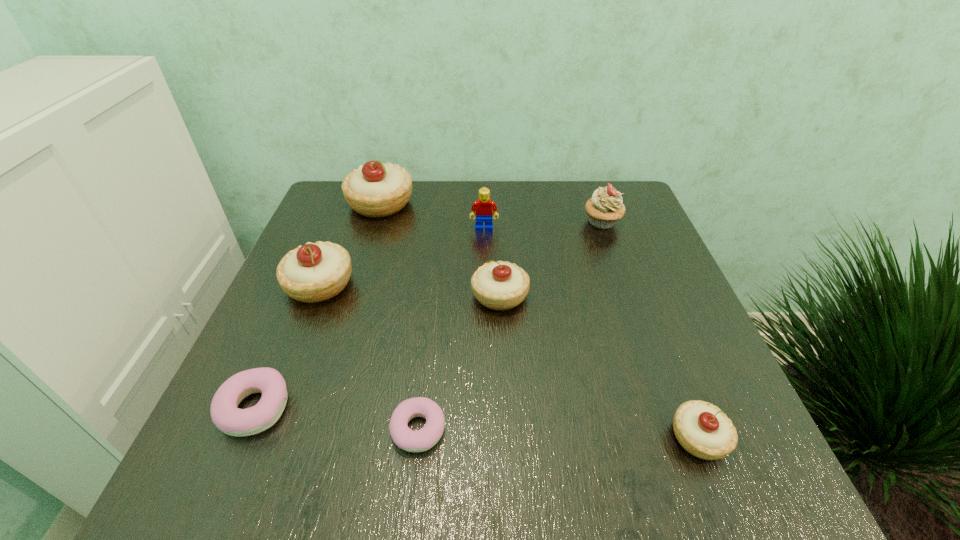
Image resolution: width=960 pixels, height=540 pixels. In order to click on free location that satisfies the following two spatial constraints: 1. on the back side of the second biggest beige pastry; 2. on the left side of the cupcake in this screenshot , I will do `click(345, 222)`.

The image size is (960, 540). Find the location of `free location that satisfies the following two spatial constraints: 1. on the front-facing side of the red Lego; 2. on the left side of the fourth shortest object`. free location that satisfies the following two spatial constraints: 1. on the front-facing side of the red Lego; 2. on the left side of the fourth shortest object is located at coordinates (485, 295).

Where is `vacant space that satisfies the following two spatial constraints: 1. on the front-facing side of the Lego; 2. on the left side of the rightmost pastry`? The image size is (960, 540). vacant space that satisfies the following two spatial constraints: 1. on the front-facing side of the Lego; 2. on the left side of the rightmost pastry is located at coordinates (487, 437).